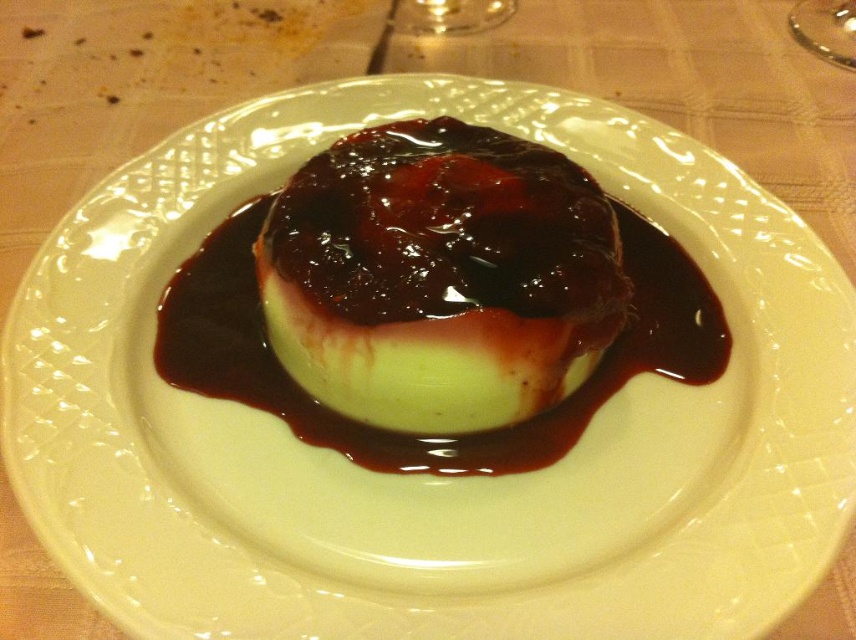
Question: Is white creamy pudding at center positioned behind transparent glass at upper right?

Choices:
 (A) yes
 (B) no

Answer: (B)

Question: Which object is farther from the camera taking this photo?

Choices:
 (A) white creamy pudding at center
 (B) transparent glass at upper right

Answer: (B)

Question: From the image, what is the correct spatial relationship of white creamy pudding at center in relation to transparent glass at upper right?

Choices:
 (A) below
 (B) above

Answer: (A)

Question: Observing the image, what is the correct spatial positioning of white creamy pudding at center in reference to transparent glass at upper right?

Choices:
 (A) right
 (B) left

Answer: (B)